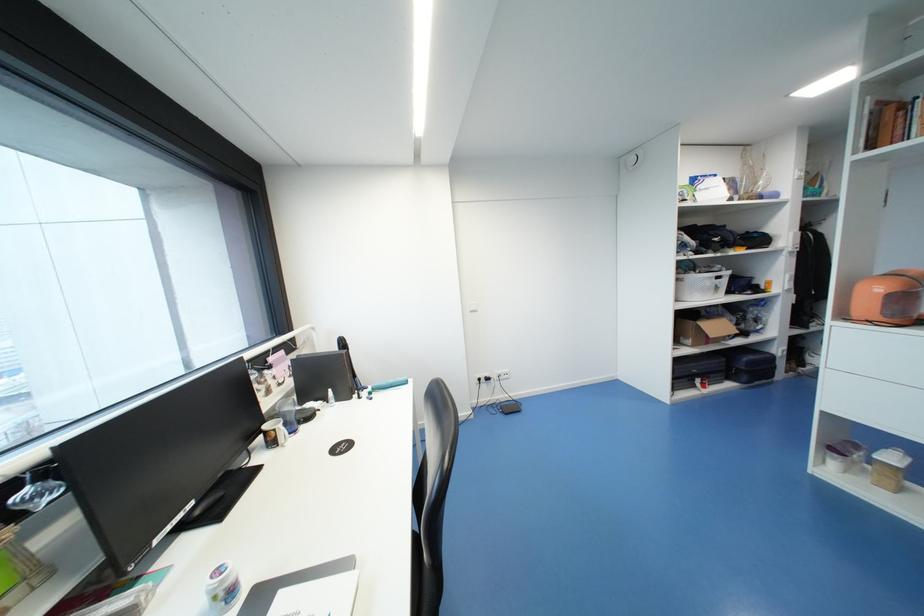
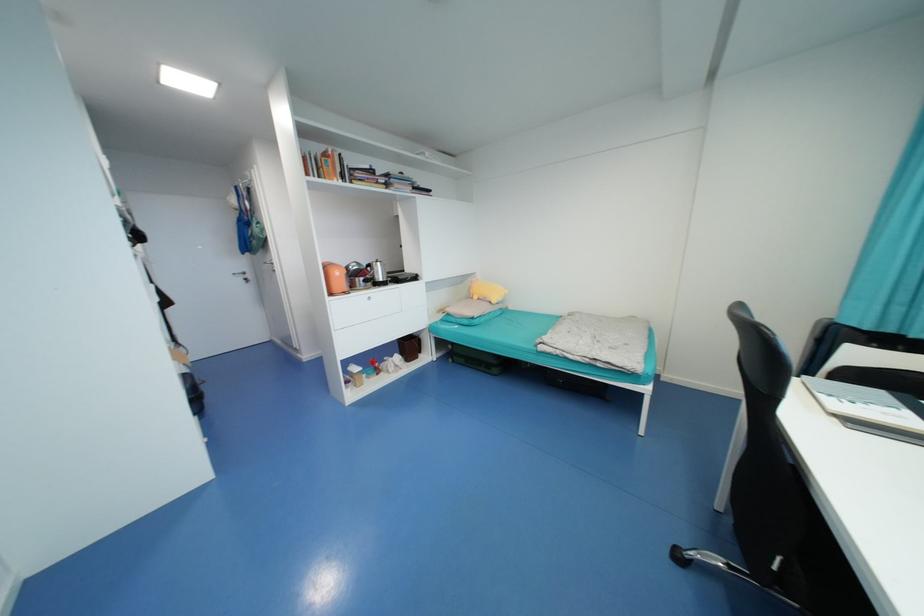
Question: I am providing you with two images of the same scene from different viewpoints. After the viewpoint changes to image2, which objects are now occluded?

Choices:
 (A) orange kettle
 (B) white cylindrical object
 (C) silver electric kettle
 (D) black suitcase

Answer: (D)